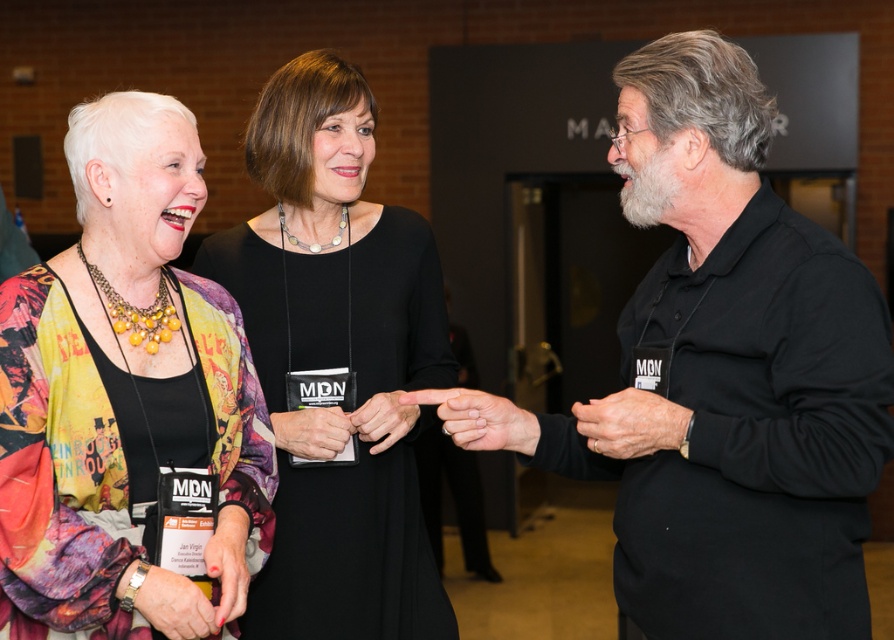
Based on the photo, you are standing in front of the image and want to determine which of the two points, point (601, 422) or point (415, 353), is closer to you. Based on the spatial relationship between them, which point is nearer?

Point (601, 422) is closer to the camera than point (415, 353), so it is the nearer point.

You are organizing a photo shoot and need to ensure that the two central participants are positioned so that their clothing items do not overlap. Given the black matte shirt at center and the black fabric dress at center, which clothing item should be placed further to the left to prevent overlap?

The black matte shirt at center is wider than the black fabric dress at center, so placing the wider black matte shirt at center further to the left would help prevent overlap between the two clothing items.

You are standing at the point labeled as point (x=673, y=464) in the image. If you want to move 2 meters forward in the direction you are facing, will you exit the room through the doorway labeled MA?

The distance between you and the doorway MA is 1.75 meters. Moving 2 meters forward would take you past the doorway, so yes, you would exit the room through the doorway MA.